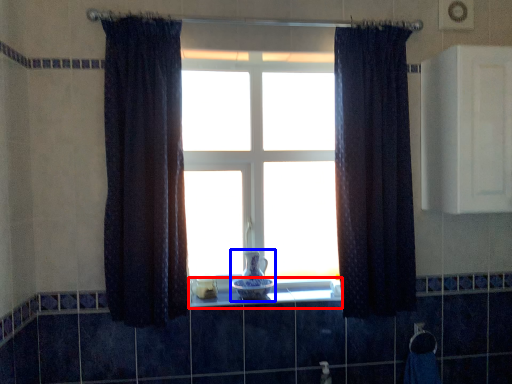
Question: Which point is closer to the camera, window sill (highlighted by a red box) or glass vase (highlighted by a blue box)?

Choices:
 (A) window sill
 (B) glass vase

Answer: (A)